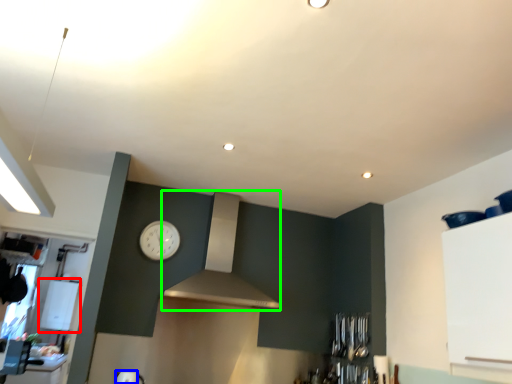
Question: Estimate the real-world distances between objects in this image. Which object is closer to appliance (highlighted by a red box), appliance (highlighted by a blue box) or vent (highlighted by a green box)?

Choices:
 (A) appliance
 (B) vent

Answer: (A)